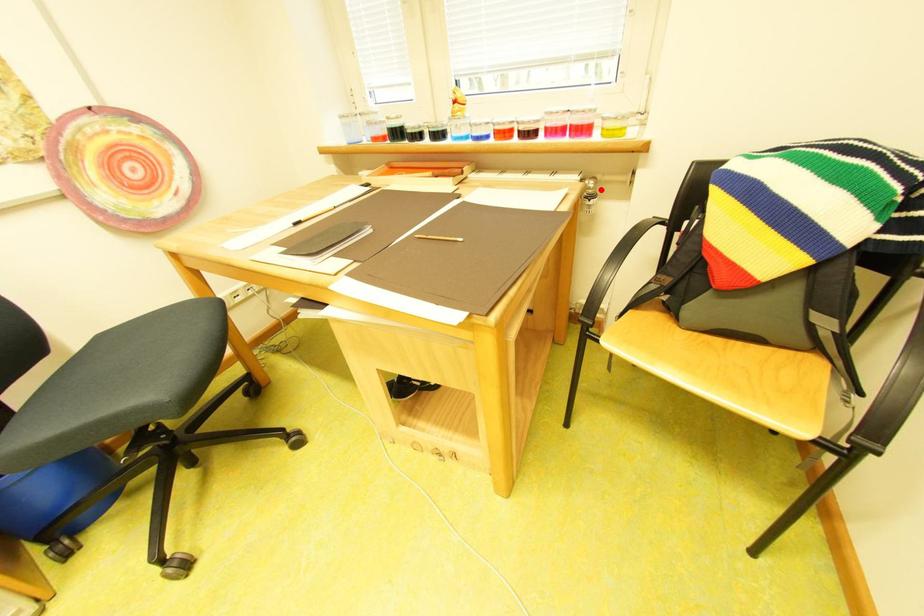
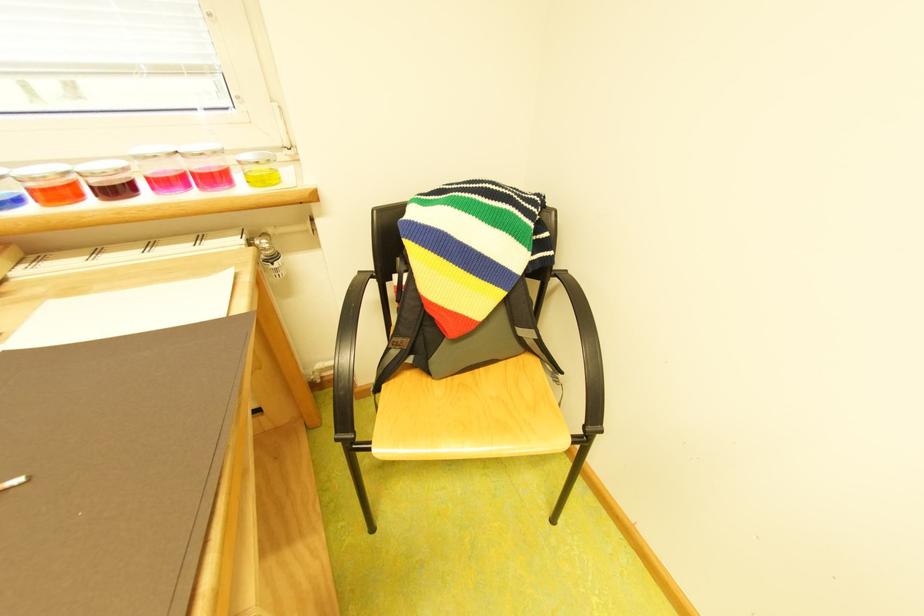
Where in the second image is the point corresponding to the highlighted location from the first image?

(275, 251)